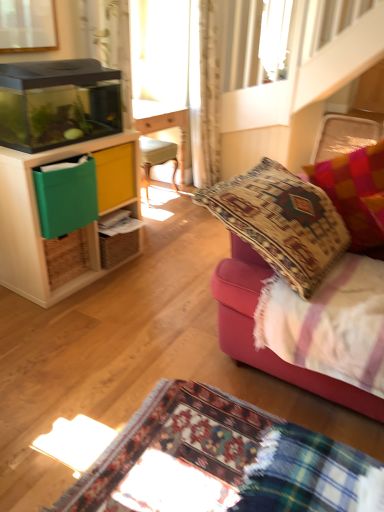
Question: Does velvet cushion at right lie in front of multicolored woven pillow at right?

Choices:
 (A) no
 (B) yes

Answer: (B)

Question: Considering the relative sizes of velvet cushion at right and multicolored woven pillow at right in the image provided, is velvet cushion at right smaller than multicolored woven pillow at right?

Choices:
 (A) yes
 (B) no

Answer: (B)

Question: From the image's perspective, is velvet cushion at right below multicolored woven pillow at right?

Choices:
 (A) yes
 (B) no

Answer: (A)

Question: Is velvet cushion at right bigger than multicolored woven pillow at right?

Choices:
 (A) yes
 (B) no

Answer: (A)

Question: Is velvet cushion at right not near multicolored woven pillow at right?

Choices:
 (A) yes
 (B) no

Answer: (B)

Question: From the image's perspective, relative to velvet cushion at right, is light beige textured curtain at upper center above or below?

Choices:
 (A) below
 (B) above

Answer: (B)

Question: Looking at their shapes, would you say light beige textured curtain at upper center is wider or thinner than velvet cushion at right?

Choices:
 (A) thin
 (B) wide

Answer: (A)

Question: Is point (201, 64) closer or farther from the camera than point (238, 289)?

Choices:
 (A) closer
 (B) farther

Answer: (B)

Question: From a real-world perspective, relative to velvet cushion at right, is light beige textured curtain at upper center vertically above or below?

Choices:
 (A) above
 (B) below

Answer: (A)

Question: Considering the relative positions of velvet cushion at right and matte wood cabinet at left in the image provided, is velvet cushion at right to the left or to the right of matte wood cabinet at left?

Choices:
 (A) right
 (B) left

Answer: (A)

Question: Considering the positions of velvet cushion at right and matte wood cabinet at left in the image, is velvet cushion at right bigger or smaller than matte wood cabinet at left?

Choices:
 (A) big
 (B) small

Answer: (A)

Question: Is velvet cushion at right taller or shorter than matte wood cabinet at left?

Choices:
 (A) tall
 (B) short

Answer: (B)

Question: Is velvet cushion at right situated inside matte wood cabinet at left or outside?

Choices:
 (A) inside
 (B) outside

Answer: (B)

Question: Considering the positions of velvet cushion at right and multicolored woven pillow at right in the image, is velvet cushion at right bigger or smaller than multicolored woven pillow at right?

Choices:
 (A) small
 (B) big

Answer: (B)

Question: From the image's perspective, is velvet cushion at right above or below multicolored woven pillow at right?

Choices:
 (A) below
 (B) above

Answer: (A)